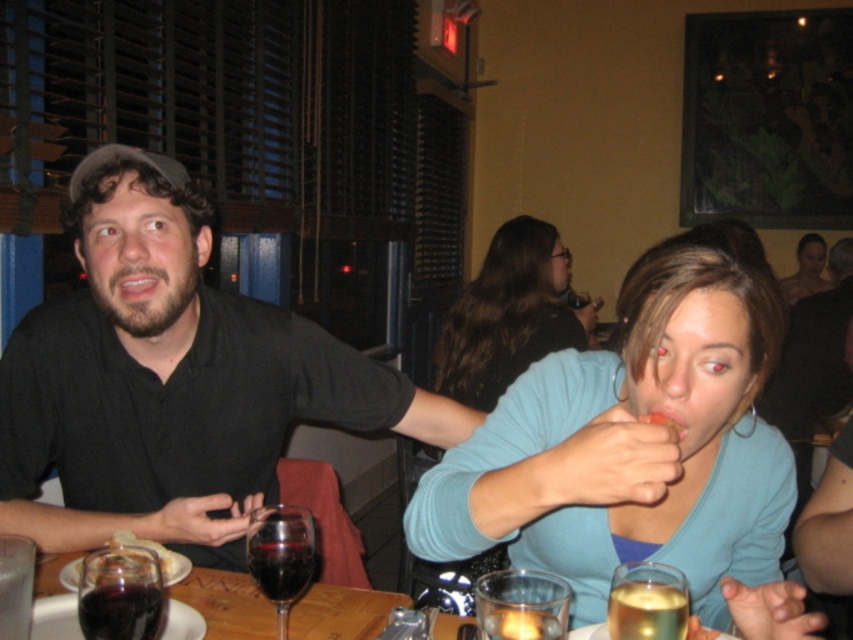
Question: Can you confirm if black matte shirt at left is wider than translucent glass at lower right?

Choices:
 (A) yes
 (B) no

Answer: (A)

Question: Which point appears farthest from the camera in this image?

Choices:
 (A) (218, 403)
 (B) (541, 589)

Answer: (A)

Question: Which point is closer to the camera?

Choices:
 (A) black matte shirt at left
 (B) translucent glass candle at lower center
 (C) slightly browned bread at mouth

Answer: (B)

Question: Does translucent glass at lower right appear over dark glassy cola at lower left?

Choices:
 (A) yes
 (B) no

Answer: (A)

Question: Which of these objects is positioned closest to the black matte shirt at left?

Choices:
 (A) translucent glass wine glass at lower left
 (B) translucent glass at lower right
 (C) transparent glass at table left
 (D) translucent glass candle at lower center

Answer: (A)

Question: Does brown hair at center appear under translucent glass candle at lower center?

Choices:
 (A) no
 (B) yes

Answer: (A)